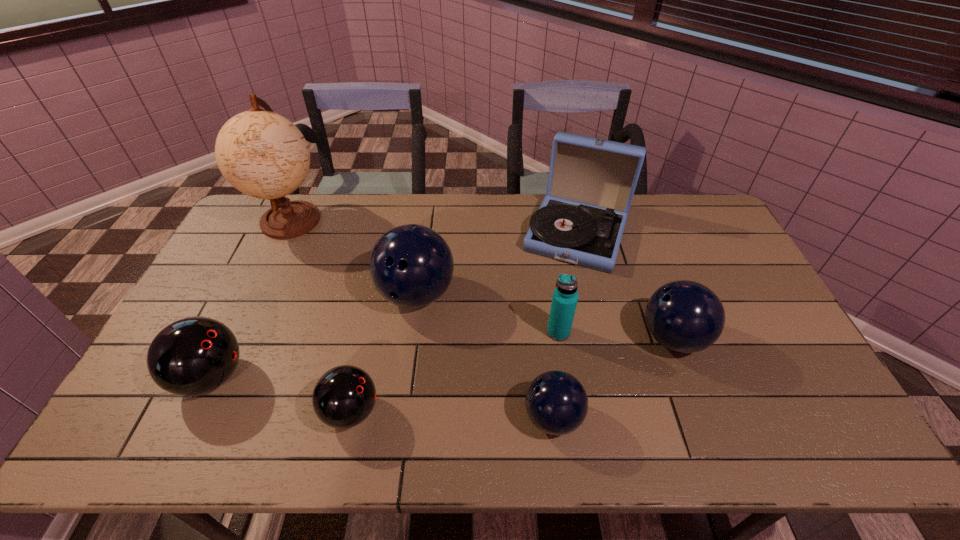
Locate an element on the screen. The width and height of the screenshot is (960, 540). object at the far left corner is located at coordinates (262, 154).

What are the coordinates of `free space at the far edge of the desktop` in the screenshot? It's located at (535, 203).

Where is `vacant space at the near edge of the desktop`? This screenshot has width=960, height=540. vacant space at the near edge of the desktop is located at coordinates (714, 441).

Where is `free space at the left edge of the desktop`? The image size is (960, 540). free space at the left edge of the desktop is located at coordinates (212, 314).

Locate an element on the screen. This screenshot has height=540, width=960. vacant area at the right edge is located at coordinates (797, 403).

The height and width of the screenshot is (540, 960). Find the location of `vacant region at the near left corner of the desktop`. vacant region at the near left corner of the desktop is located at coordinates (149, 433).

This screenshot has width=960, height=540. Identify the location of free point between the blue phonograph record and the leftmost blue bowling ball. (496, 264).

The height and width of the screenshot is (540, 960). What are the coordinates of `free space between the bigger black bowling ball and the nearest blue bowling ball` in the screenshot? It's located at (382, 397).

Locate an element on the screen. The height and width of the screenshot is (540, 960). unoccupied position between the biggest blue bowling ball and the left black bowling ball is located at coordinates (314, 335).

Image resolution: width=960 pixels, height=540 pixels. In order to click on free area in between the second blue bowling ball from left to right and the bigger black bowling ball in this screenshot , I will do click(382, 397).